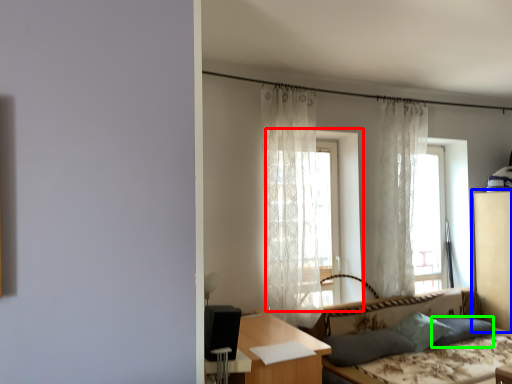
Question: Based on their relative distances, which object is nearer to screen door (highlighted by a red box)? Choose from dresser (highlighted by a blue box) and pillow (highlighted by a green box).

Choices:
 (A) dresser
 (B) pillow

Answer: (B)